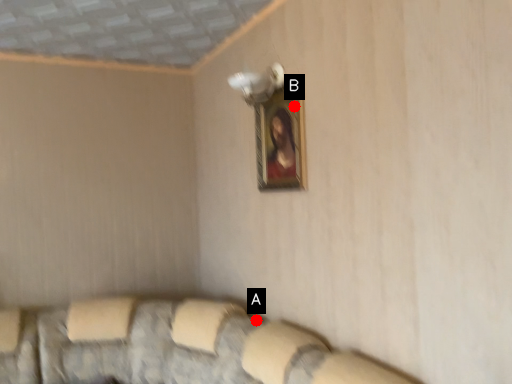
Question: Two points are circled on the image, labeled by A and B beside each circle. Which of the following is the closest to the observer?

Choices:
 (A) A is closer
 (B) B is closer

Answer: (B)